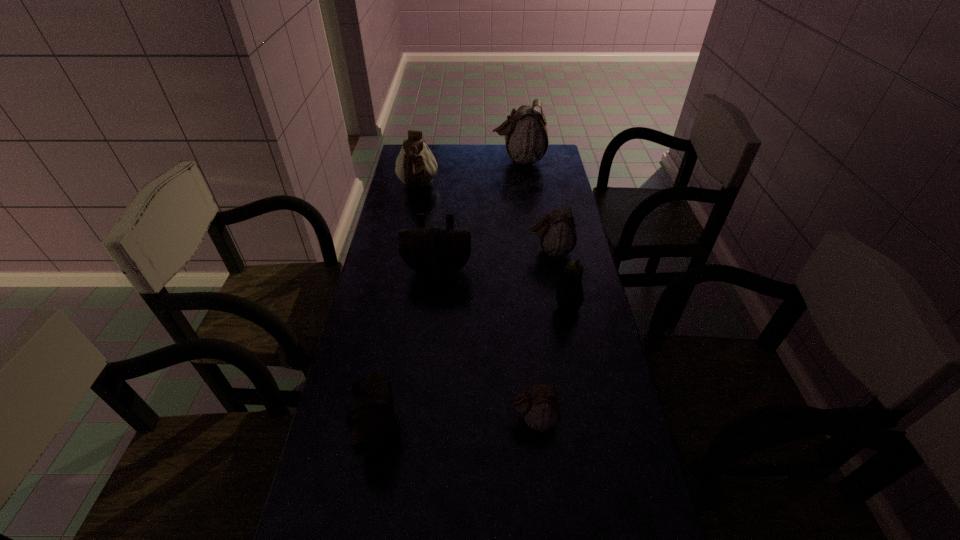
Find the location of a particular element. This screenshot has height=540, width=960. the biggest white pouch is located at coordinates (526, 137).

In order to click on the farthest white pouch in this screenshot , I will do `click(526, 137)`.

Find the location of a particular element. Image resolution: width=960 pixels, height=540 pixels. the leftmost white pouch is located at coordinates (415, 165).

At what (x,y) coordinates should I click in order to perform the action: click on the second biggest white pouch. Please return your answer as a coordinate pair (x, y). Looking at the image, I should click on (415, 165).

Identify the location of the fifth farthest object. (569, 295).

In order to click on the bigger brown pouch in this screenshot , I will do `click(435, 251)`.

Where is `the second nearest white pouch`? the second nearest white pouch is located at coordinates (557, 232).

I want to click on the smaller brown pouch, so click(x=372, y=418).

Identify the location of the shortest object. Image resolution: width=960 pixels, height=540 pixels. (540, 407).

Locate an element on the screen. Image resolution: width=960 pixels, height=540 pixels. the shortest pouch is located at coordinates (540, 407).